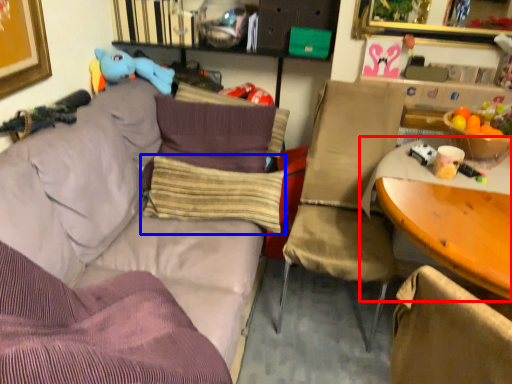
Question: Which object appears closest to the camera in this image, table (highlighted by a red box) or pillow (highlighted by a blue box)?

Choices:
 (A) table
 (B) pillow

Answer: (A)